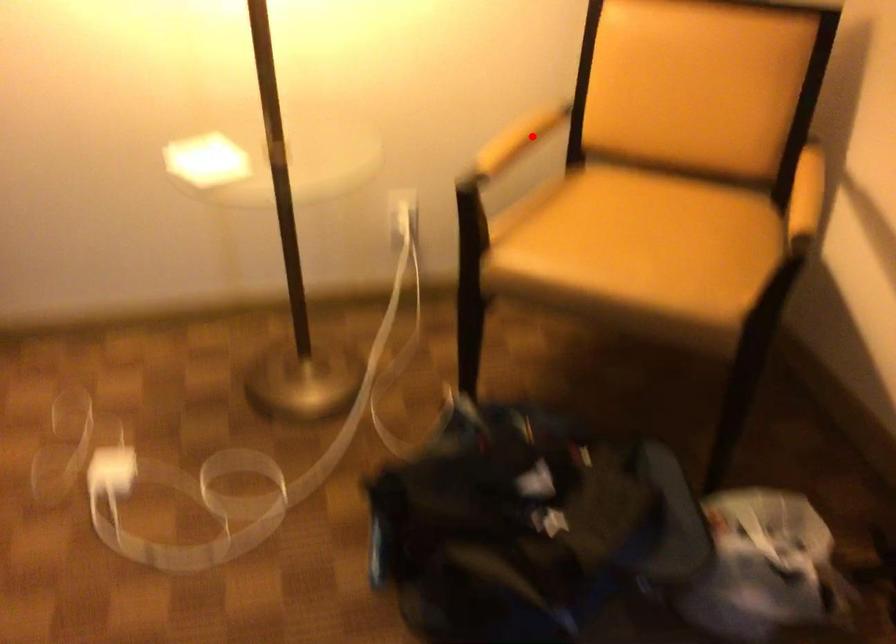
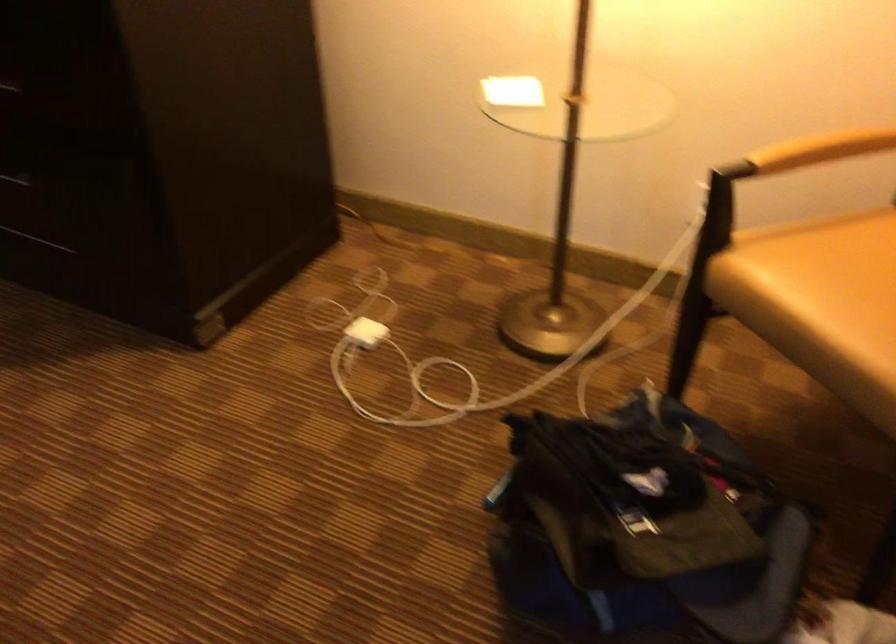
Question: I am providing you with two images of the same scene from different viewpoints. In image1, a red point is highlighted. Considering the same 3D point in image2, which of the following is correct?

Choices:
 (A) It is closer
 (B) It is farther

Answer: (A)